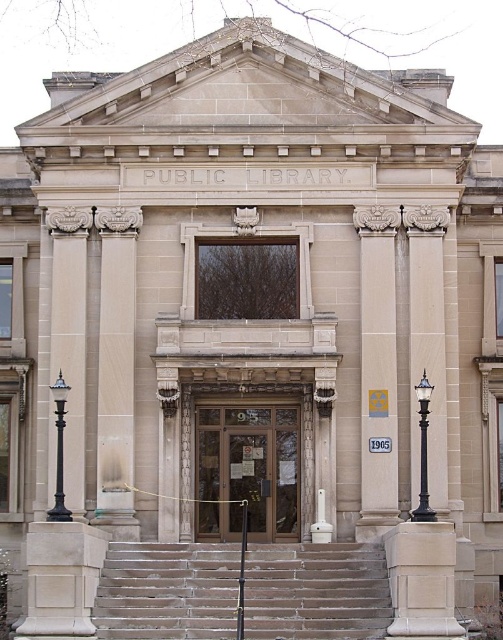
You are a delivery person with a large package that is 1.2 meters wide. You need to enter the library through the wooden door at center. Can the package fit through the door if the beige stone column at center is 1.5 meters wide?

The wooden door at center is narrower than the beige stone column at center. Since the beige stone column at center is 1.5 meters wide and the wooden door at center is less than that, the door is at least 1.5 meters wide? Wait, no. Wait, the description says the door is less than the column. The column is 1.5m wide, so the door is less than 1.5m. The package is 1.2m. If the door is less than 1.5m, it could be, say, 1.4m, which is wider than 1.2m, so yes. But if the door is 1.1m, then no. Hmm, the problem is